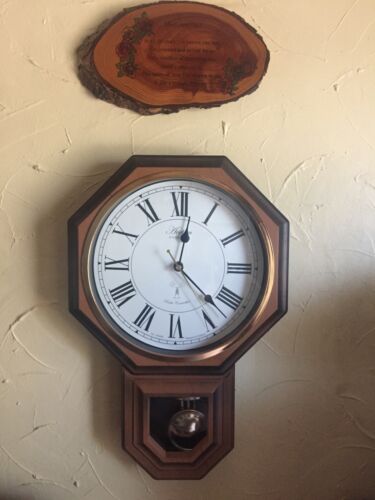
Where is `wall`? The height and width of the screenshot is (500, 375). wall is located at coordinates (316, 139), (27, 381).